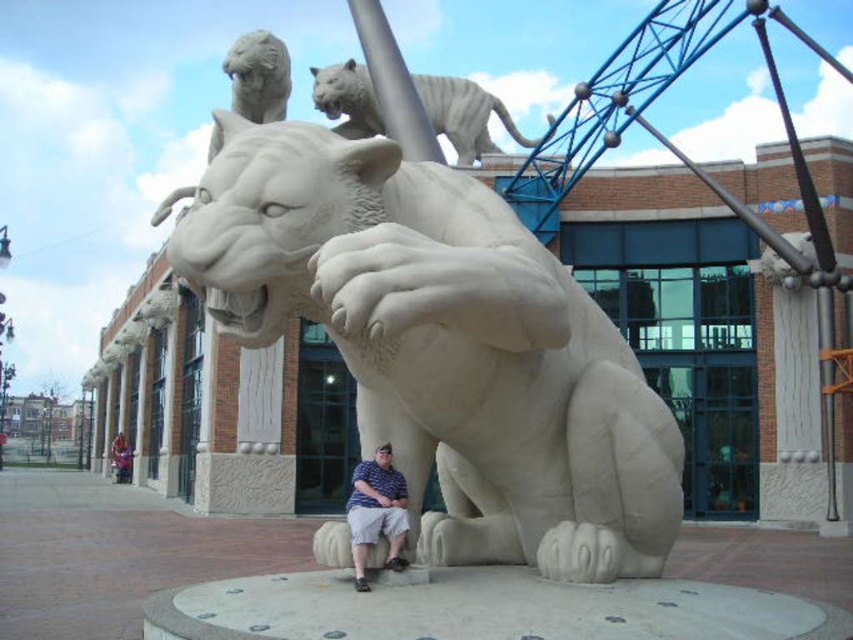
Who is positioned more to the left, white stone lion at center or striped shirt at center?

white stone lion at center is more to the left.

Who is positioned more to the right, white stone lion at center or striped shirt at center?

From the viewer's perspective, striped shirt at center appears more on the right side.

Locate an element on the screen. white stone lion at center is located at coordinates (444, 346).

Which is more to the right, white marble tiger at upper center or striped shirt at center?

Positioned to the right is white marble tiger at upper center.

Does white marble tiger at upper center have a larger size compared to striped shirt at center?

Yes.

Is point (469, 122) more distant than point (363, 516)?

Yes, it is.

I want to click on white marble tiger at upper center, so click(x=463, y=115).

Which is behind, point (294, 257) or point (483, 129)?

The point (483, 129) is more distant.

Which is more to the left, white stone lion at center or white marble tiger at upper center?

Positioned to the left is white stone lion at center.

Where is `white stone lion at center`? Image resolution: width=853 pixels, height=640 pixels. white stone lion at center is located at coordinates (444, 346).